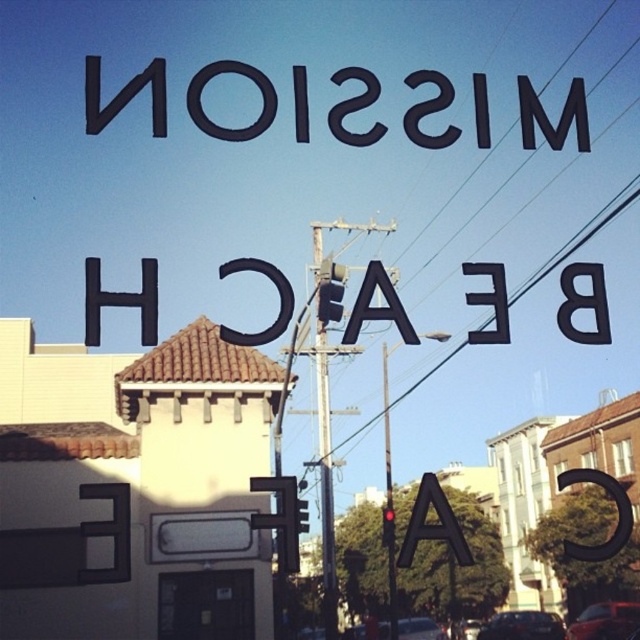
Is point (324, 568) positioned behind point (470, 560)?

That is True.

Is metallic gray pole at center above black matte letter a at center?

Yes, metallic gray pole at center is above black matte letter a at center.

Image resolution: width=640 pixels, height=640 pixels. Describe the element at coordinates (324, 436) in the screenshot. I see `metallic gray pole at center` at that location.

The height and width of the screenshot is (640, 640). Find the location of `metallic gray pole at center`. metallic gray pole at center is located at coordinates (324, 436).

Does metallic gray pole at center have a greater width compared to metallic wire at center?

No, metallic gray pole at center is not wider than metallic wire at center.

Does point (321, 269) come in front of point (547, 273)?

That is False.

In order to click on metallic gray pole at center in this screenshot , I will do `click(324, 436)`.

The width and height of the screenshot is (640, 640). What do you see at coordinates (124, 96) in the screenshot? I see `black matte sign at upper center` at bounding box center [124, 96].

Consider the image. Between black matte sign at upper center and metallic gray pole at center, which one has less height?

With less height is black matte sign at upper center.

Is point (99, 72) positioned before point (316, 256)?

Yes.

Find the location of `black matte sign at upper center`. black matte sign at upper center is located at coordinates (124, 96).